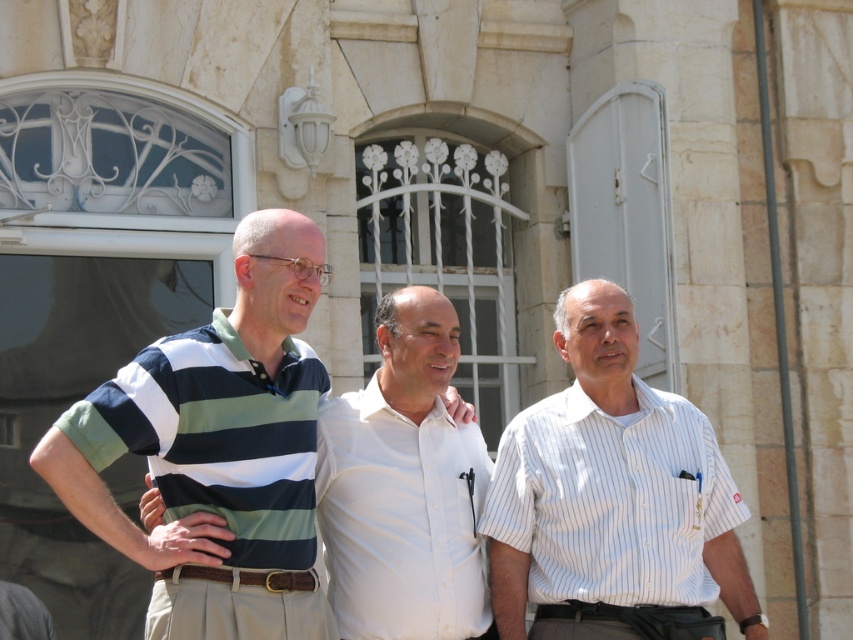
Question: Does white striped shirt at center appear on the left side of striped cotton polo shirt at center?

Choices:
 (A) yes
 (B) no

Answer: (B)

Question: Which of the following is the farthest from the observer?

Choices:
 (A) white striped shirt at center
 (B) striped cotton polo shirt at center

Answer: (A)

Question: Is white striped shirt at center further to the viewer compared to striped cotton polo shirt at center?

Choices:
 (A) no
 (B) yes

Answer: (B)

Question: Does white striped shirt at center have a smaller size compared to striped cotton polo shirt at center?

Choices:
 (A) no
 (B) yes

Answer: (B)

Question: Which of the following is the closest to the observer?

Choices:
 (A) (577, 506)
 (B) (318, 616)

Answer: (B)